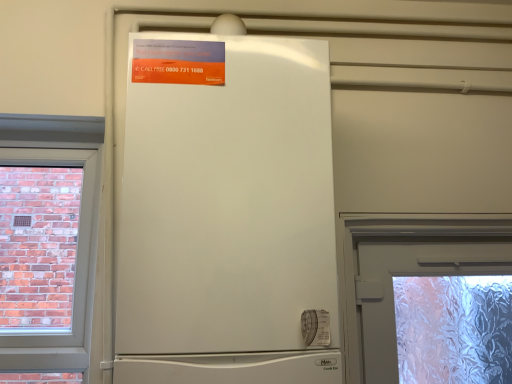
Measure the distance between orange glossy poster at upper center and camera.

orange glossy poster at upper center is 35.83 inches from camera.

This screenshot has height=384, width=512. I want to click on orange glossy poster at upper center, so click(178, 62).

Measure the distance between point (191,46) and camera.

Point (191,46) and camera are 36.77 inches apart from each other.

What do you see at coordinates (178, 62) in the screenshot?
I see `orange glossy poster at upper center` at bounding box center [178, 62].

What do you see at coordinates (228, 220) in the screenshot? I see `white matte refrigerator at center` at bounding box center [228, 220].

This screenshot has height=384, width=512. What are the coordinates of `white matte refrigerator at center` in the screenshot? It's located at (228, 220).

Find the location of a particular element. orange glossy poster at upper center is located at coordinates (178, 62).

Can you confirm if orange glossy poster at upper center is positioned to the right of white matte refrigerator at center?

No, orange glossy poster at upper center is not to the right of white matte refrigerator at center.

Does orange glossy poster at upper center lie in front of white matte refrigerator at center?

No, orange glossy poster at upper center is further to the viewer.

Is point (202, 55) positioned before point (293, 285)?

No, (202, 55) is further to viewer.

From the image's perspective, relative to white matte refrigerator at center, is orange glossy poster at upper center above or below?

Clearly, from the image's perspective, orange glossy poster at upper center is above white matte refrigerator at center.

From a real-world perspective, is orange glossy poster at upper center over white matte refrigerator at center?

Correct, in the physical world, orange glossy poster at upper center is higher than white matte refrigerator at center.

Does orange glossy poster at upper center have a lesser width compared to white matte refrigerator at center?

Correct, the width of orange glossy poster at upper center is less than that of white matte refrigerator at center.

Which of these two, orange glossy poster at upper center or white matte refrigerator at center, stands shorter?

With less height is orange glossy poster at upper center.

Can you confirm if orange glossy poster at upper center is bigger than white matte refrigerator at center?

No, orange glossy poster at upper center is not bigger than white matte refrigerator at center.

Choose the correct answer: Is orange glossy poster at upper center inside white matte refrigerator at center or outside it?

orange glossy poster at upper center exists entirely within white matte refrigerator at center.

Is orange glossy poster at upper center not close to white matte refrigerator at center?

orange glossy poster at upper center is actually quite close to white matte refrigerator at center.

From the picture: Could you tell me if orange glossy poster at upper center is facing white matte refrigerator at center?

Yes, orange glossy poster at upper center is aimed at white matte refrigerator at center.

How many degrees apart are the facing directions of orange glossy poster at upper center and white matte refrigerator at center?

1.96 degrees.

The image size is (512, 384). In order to click on refrigerator that appears below the orange glossy poster at upper center (from the image's perspective) in this screenshot , I will do `click(228, 220)`.

Considering the positions of objects white matte refrigerator at center and orange glossy poster at upper center in the image provided, who is more to the right, white matte refrigerator at center or orange glossy poster at upper center?

Positioned to the right is white matte refrigerator at center.

Which is behind, white matte refrigerator at center or orange glossy poster at upper center?

orange glossy poster at upper center is more distant.

Considering the points (223, 284) and (155, 59), which point is behind, point (223, 284) or point (155, 59)?

Point (155, 59)

From the image's perspective, who appears lower, white matte refrigerator at center or orange glossy poster at upper center?

white matte refrigerator at center, from the image's perspective.

From a real-world perspective, is white matte refrigerator at center located higher than orange glossy poster at upper center?

No, from a real-world perspective, white matte refrigerator at center is not over orange glossy poster at upper center

Considering the sizes of objects white matte refrigerator at center and orange glossy poster at upper center in the image provided, who is wider, white matte refrigerator at center or orange glossy poster at upper center?

white matte refrigerator at center.

Can you confirm if white matte refrigerator at center is taller than orange glossy poster at upper center?

Correct, white matte refrigerator at center is much taller as orange glossy poster at upper center.

Can you confirm if white matte refrigerator at center is bigger than orange glossy poster at upper center?

Yes, white matte refrigerator at center is bigger than orange glossy poster at upper center.

Is white matte refrigerator at center not within orange glossy poster at upper center?

Absolutely, white matte refrigerator at center is external to orange glossy poster at upper center.

Is white matte refrigerator at center not close to orange glossy poster at upper center?

white matte refrigerator at center is near orange glossy poster at upper center, not far away.

Consider the image. Could you tell me if white matte refrigerator at center is turned towards orange glossy poster at upper center?

Yes.

Can you tell me how much white matte refrigerator at center and orange glossy poster at upper center differ in facing direction?

The facing directions of white matte refrigerator at center and orange glossy poster at upper center are 1.96 degrees apart.

This screenshot has height=384, width=512. Find the location of `refrigerator below the orange glossy poster at upper center (from the image's perspective)`. refrigerator below the orange glossy poster at upper center (from the image's perspective) is located at coordinates (228, 220).

The image size is (512, 384). Identify the location of refrigerator below the orange glossy poster at upper center (from the image's perspective). (228, 220).

This screenshot has height=384, width=512. Find the location of `refrigerator in front of the orange glossy poster at upper center`. refrigerator in front of the orange glossy poster at upper center is located at coordinates (228, 220).